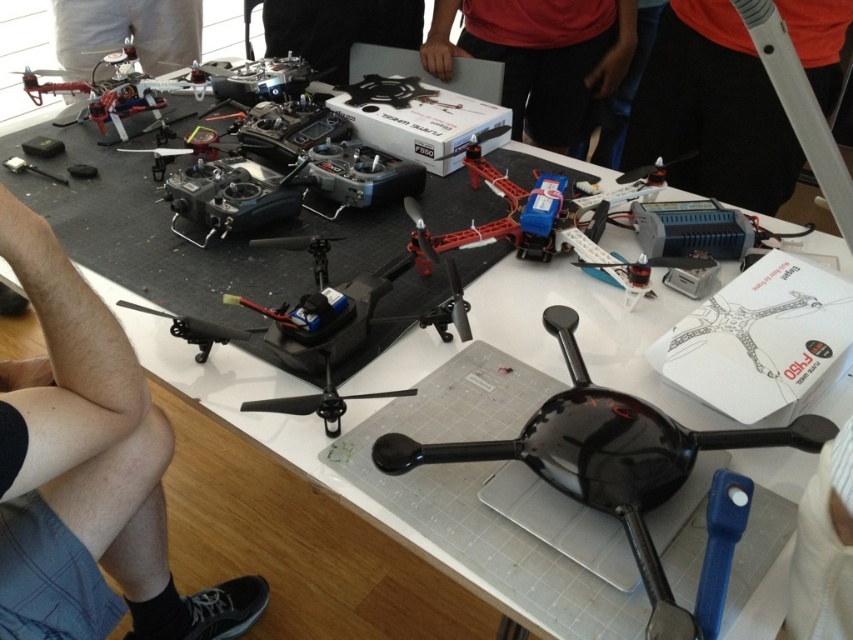
Question: Does orange fabric shirt at upper right come behind black plastic drone at lower left?

Choices:
 (A) no
 (B) yes

Answer: (B)

Question: Which point is closer to the camera?

Choices:
 (A) skinny jeans at lower left
 (B) metallic silver drone at upper left
 (C) metallic silver screwdriver at lower left

Answer: (A)

Question: Which point is closer to the camera?

Choices:
 (A) black plastic drone at lower left
 (B) orange fabric shirt at upper right

Answer: (A)

Question: Can you confirm if orange fabric shirt at upper right is positioned to the right of black plastic drone at lower left?

Choices:
 (A) yes
 (B) no

Answer: (A)

Question: Which of these objects is positioned farthest from the red matte box at center?

Choices:
 (A) metallic silver screwdriver at lower left
 (B) orange fabric shirt at upper right
 (C) black glossy drone at center
 (D) black plastic propeller at center

Answer: (D)

Question: Is orange fabric shirt at upper right positioned in front of black plastic propeller at center?

Choices:
 (A) yes
 (B) no

Answer: (B)